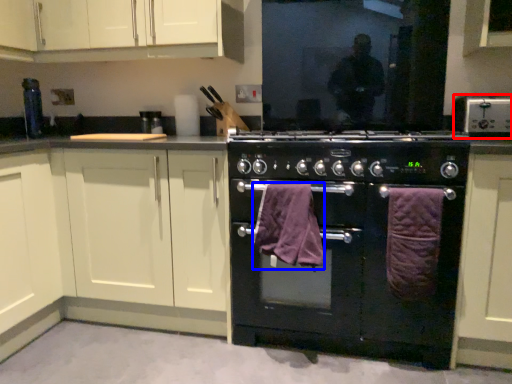
Question: Which of the following is the closest to the observer, kitchen appliance (highlighted by a red box) or bath towel (highlighted by a blue box)?

Choices:
 (A) kitchen appliance
 (B) bath towel

Answer: (B)